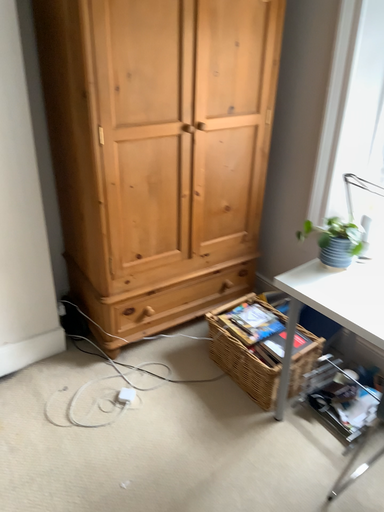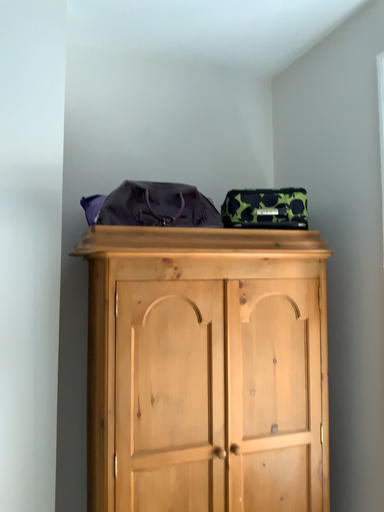
Question: How did the camera likely rotate when shooting the video?

Choices:
 (A) rotated upward
 (B) rotated downward

Answer: (A)